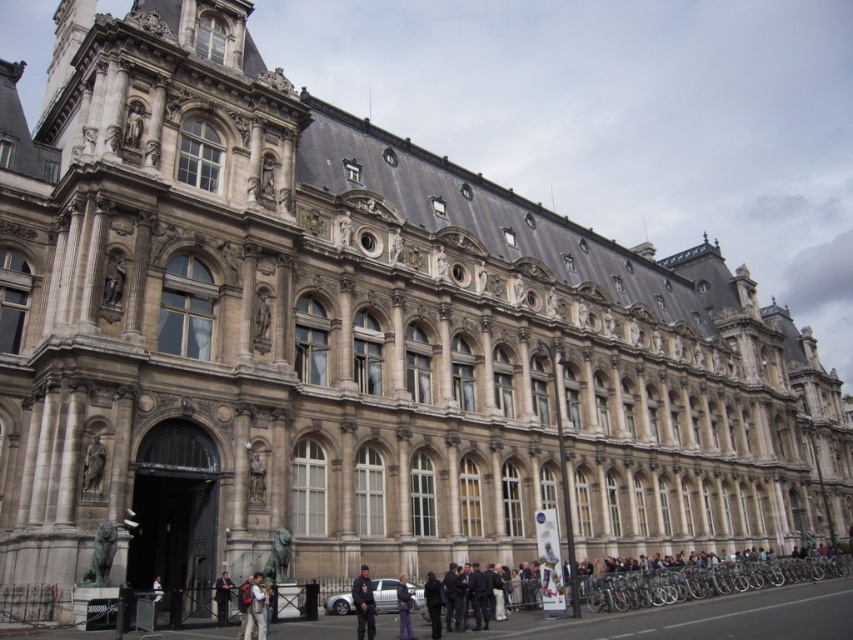
Question: Which object appears closest to the camera in this image?

Choices:
 (A) dark blue uniform at center
 (B) dark gray uniform at lower center
 (C) dark gray jacket at center

Answer: (A)

Question: Is dark blue uniform at center smaller than dark gray jacket at center?

Choices:
 (A) no
 (B) yes

Answer: (A)

Question: Is dark blue jeans at lower center closer to camera compared to polished bronze statue at upper center?

Choices:
 (A) yes
 (B) no

Answer: (A)

Question: Is dark blue jeans at lower center thinner than dark gray uniform at lower center?

Choices:
 (A) no
 (B) yes

Answer: (B)

Question: Which point is farther to the camera?

Choices:
 (A) dark gray jacket at center
 (B) polished bronze statue at upper center
 (C) dark gray uniform at lower center

Answer: (B)

Question: Which object is positioned farthest from the dark blue uniform at center?

Choices:
 (A) polished bronze statue at upper center
 (B) polished bronze statue at lower left
 (C) dark blue jeans at lower center
 (D) dark gray uniform at lower center

Answer: (A)